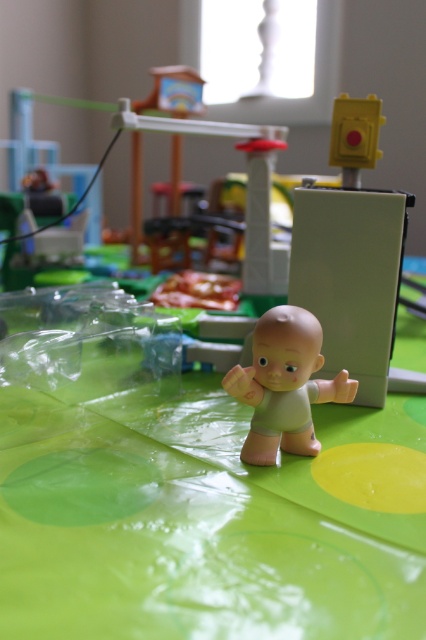
Question: Is green plastic table at center smaller than smooth beige baby at center?

Choices:
 (A) yes
 (B) no

Answer: (B)

Question: Does green plastic table at center come behind smooth beige baby at center?

Choices:
 (A) no
 (B) yes

Answer: (A)

Question: Does green plastic table at center appear on the right side of smooth beige baby at center?

Choices:
 (A) yes
 (B) no

Answer: (B)